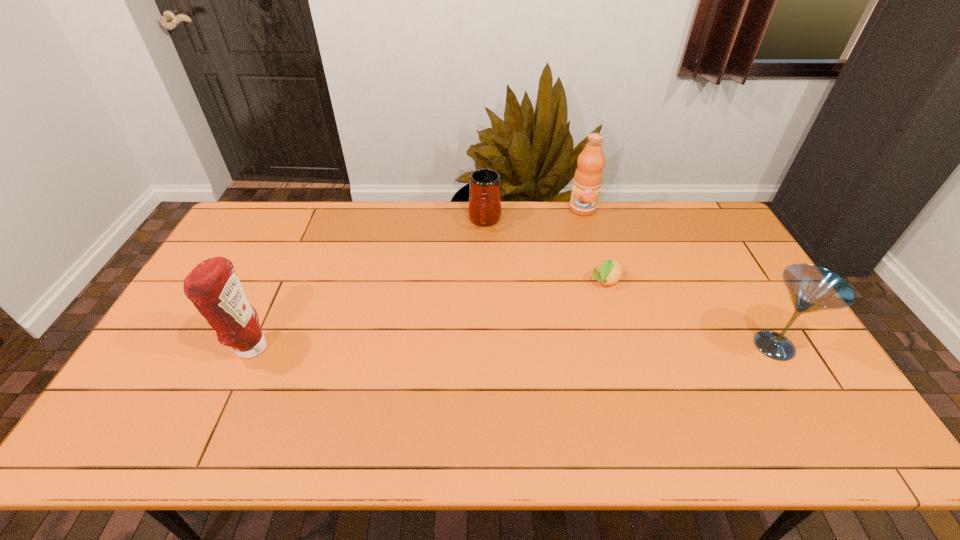
Identify the location of free spot on the desktop that is between the leftmost object and the martini and is positioned with leaves positioned above the third nearest object. (564, 347).

Locate an element on the screen. free spot on the desktop that is between the condiment and the third tallest object and is positioned on the label side of the fruit juice is located at coordinates (580, 347).

You are a GUI agent. You are given a task and a screenshot of the screen. Output one action in this format:
    pyautogui.click(x=<x>, y=<y>)
    Task: Click on the vacant space on the desktop that is between the leftmost object and the third shortest object and is positioned on the side of the fourth tallest object with the handle
    
    Given the screenshot: What is the action you would take?
    pyautogui.click(x=471, y=347)